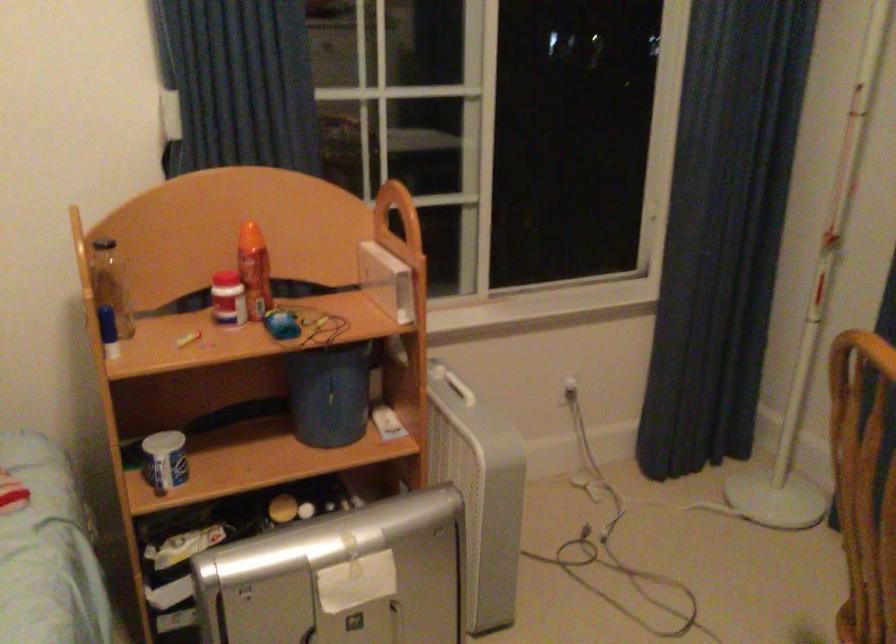
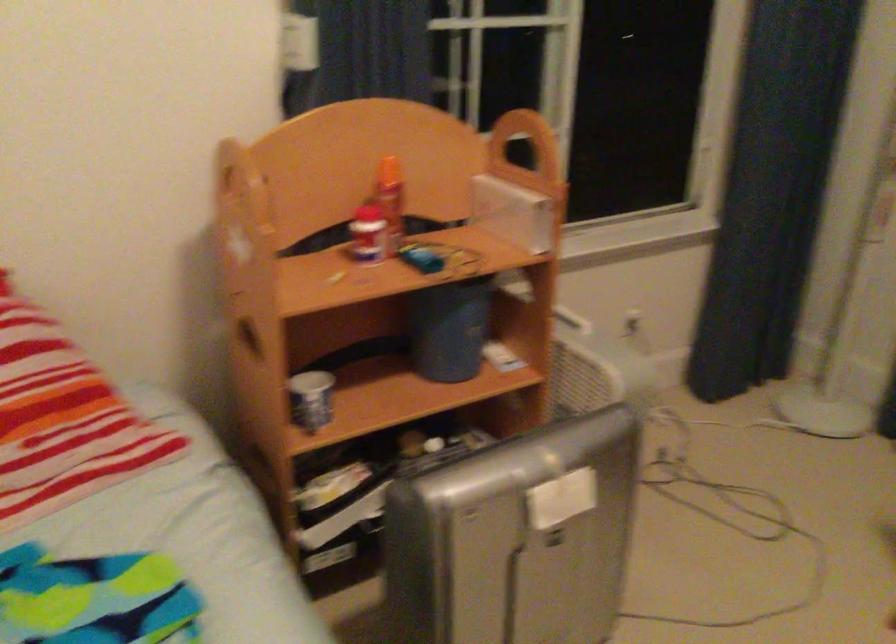
Find the pixel in the second image that matches (x=256, y=267) in the first image.

(391, 200)